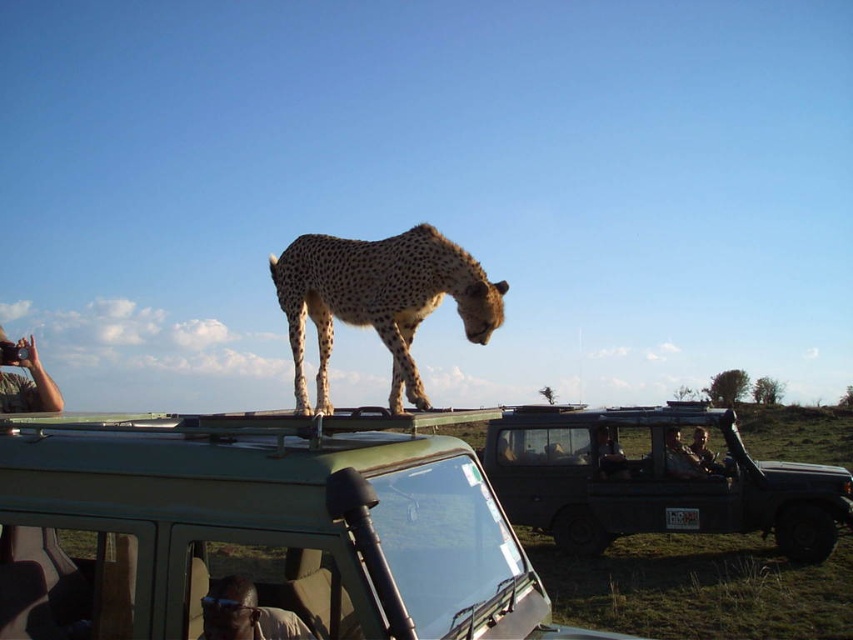
Measure the distance between green matte vehicle at center and dark skin textured face at lower center.

green matte vehicle at center is 23.64 inches from dark skin textured face at lower center.

In the scene shown: Which is more to the right, green matte vehicle at center or dark skin textured face at lower center?

From the viewer's perspective, dark skin textured face at lower center appears more on the right side.

Who is more forward, (346, 515) or (218, 595)?

Point (346, 515) is more forward.

Locate an element on the screen. green matte vehicle at center is located at coordinates (258, 531).

You are a GUI agent. You are given a task and a screenshot of the screen. Output one action in this format:
    pyautogui.click(x=<x>, y=<y>)
    Task: Click on the matte green suv at center
    The image size is (853, 640).
    Given the screenshot: What is the action you would take?
    pyautogui.click(x=654, y=481)

Does point (733, 502) come behind point (700, 440)?

That is False.

What do you see at coordinates (654, 481) in the screenshot?
I see `matte green suv at center` at bounding box center [654, 481].

I want to click on matte green suv at center, so click(x=654, y=481).

How much distance is there between dark skin textured face at lower center and leather jacket at center?

22.98 feet

Which is in front, point (212, 580) or point (669, 436)?

Positioned in front is point (212, 580).

Which is behind, point (294, 621) or point (708, 458)?

Positioned behind is point (708, 458).

This screenshot has width=853, height=640. In order to click on dark skin textured face at lower center in this screenshot , I will do `click(245, 612)`.